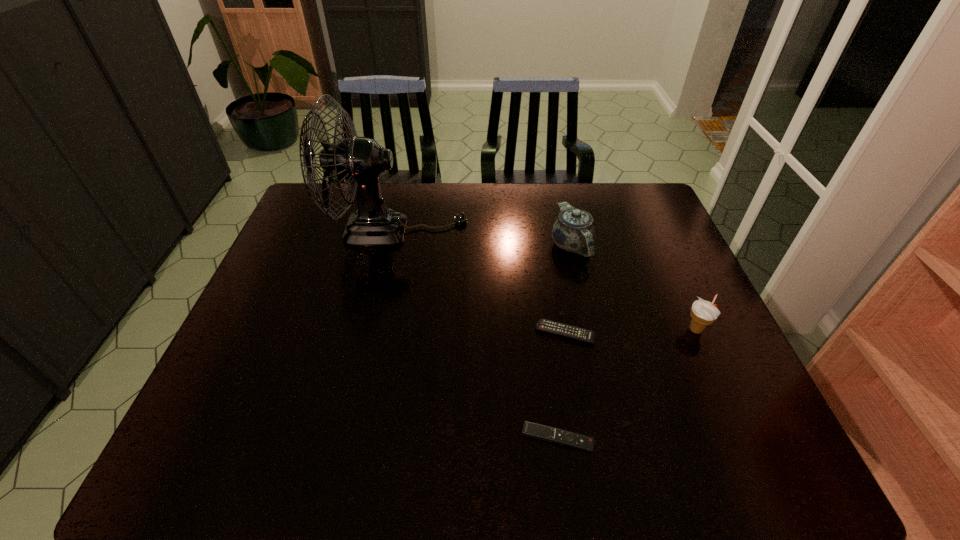
This screenshot has height=540, width=960. Find the location of `empty location between the chinaware and the nearest object`. empty location between the chinaware and the nearest object is located at coordinates (564, 342).

Where is `object that can be found as the closest to the rightmost object`? This screenshot has width=960, height=540. object that can be found as the closest to the rightmost object is located at coordinates (545, 325).

Select which object appears as the closest to the nearest object. Please provide its 2D coordinates. Your answer should be formatted as a tuple, i.e. [(x, y)], where the tuple contains the x and y coordinates of a point satisfying the conditions above.

[(545, 325)]

Find the location of a particular element. free space that satisfies the following two spatial constraints: 1. in front of the farther remote control, indicating the direction of air flow; 2. on the left side of the fan is located at coordinates (375, 333).

Where is `free space that satisfies the following two spatial constraints: 1. in front of the fan, indicating the direction of air flow; 2. on the right side of the nearer remote control`? The height and width of the screenshot is (540, 960). free space that satisfies the following two spatial constraints: 1. in front of the fan, indicating the direction of air flow; 2. on the right side of the nearer remote control is located at coordinates (352, 438).

Image resolution: width=960 pixels, height=540 pixels. What are the coordinates of `vacant space that satisfies the following two spatial constraints: 1. in front of the fan, indicating the direction of air flow; 2. on the right side of the icecream` in the screenshot? It's located at point(376,330).

Locate an element on the screen. This screenshot has width=960, height=540. vacant point that satisfies the following two spatial constraints: 1. in front of the tallest object, indicating the direction of air flow; 2. on the left side of the farther remote control is located at coordinates (375, 333).

Image resolution: width=960 pixels, height=540 pixels. Find the location of `free location that satisfies the following two spatial constraints: 1. in front of the fan, indicating the direction of air flow; 2. on the left side of the nearest object`. free location that satisfies the following two spatial constraints: 1. in front of the fan, indicating the direction of air flow; 2. on the left side of the nearest object is located at coordinates (352, 438).